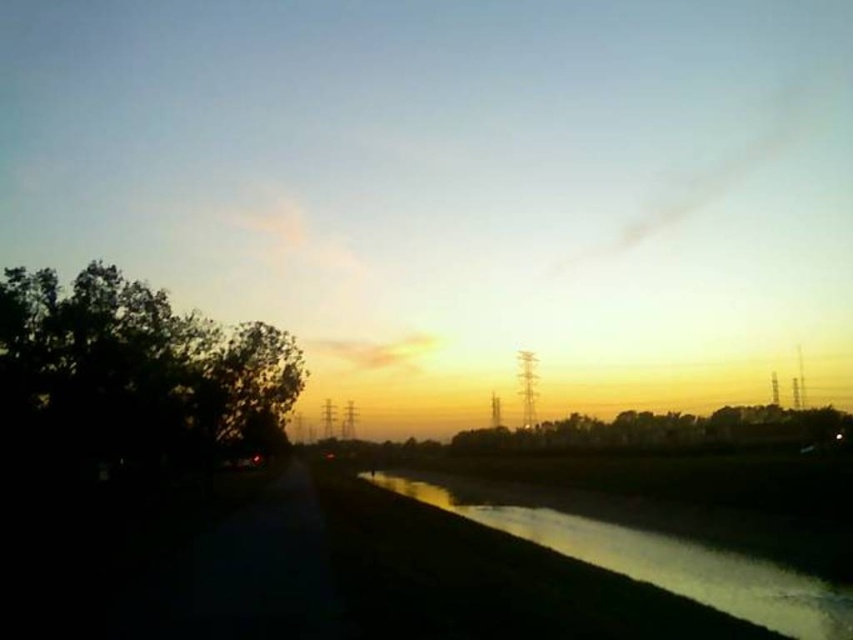
Question: Does dark green leafy tree at left appear over silvery reflective water at lower right?

Choices:
 (A) no
 (B) yes

Answer: (B)

Question: Does dark green leafy tree at left appear over silvery reflective water at lower right?

Choices:
 (A) yes
 (B) no

Answer: (A)

Question: Which point is closer to the camera taking this photo?

Choices:
 (A) (53, 451)
 (B) (775, 616)

Answer: (B)

Question: Among these objects, which one is nearest to the camera?

Choices:
 (A) dark green leafy tree at left
 (B) silvery reflective water at lower right

Answer: (B)

Question: Which point is farther to the camera?

Choices:
 (A) (109, 465)
 (B) (602, 545)

Answer: (A)

Question: Does dark green leafy tree at left appear over silvery reflective water at lower right?

Choices:
 (A) yes
 (B) no

Answer: (A)